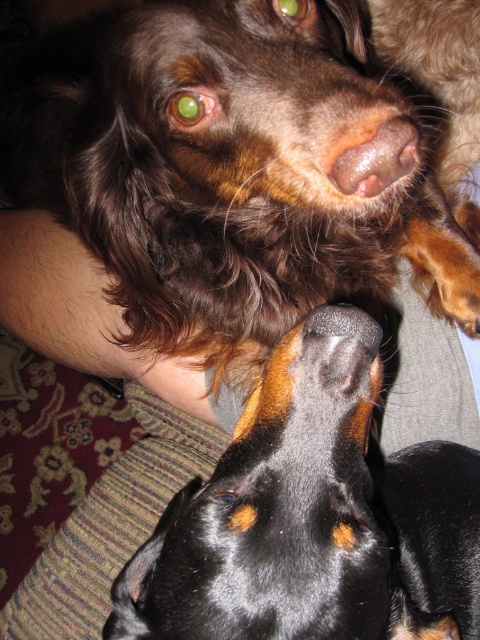
You are a photographer standing 1.5 meters away from the point at coordinates point [414,221] in the image. Can you fit both dogs into your camera frame without moving? The camera has a 50mm lens.

The distance of point [414,221] from the camera is 1.04 meters. Since you are standing 1.5 meters away from this point, you are further back than the camera position. This means the dogs are closer to the camera than your current position, so adjusting your position to be at the camera distance of 1.04 meters would allow you to capture both dogs in the frame with a 50mm lens.

You are a photographer trying to capture the perfect shot of the two dogs. You notice the brown shiny coat at upper center and the brown matte nose at center. Which object should you focus on if you want to highlight something taller in the frame?

The brown shiny coat at upper center is taller than the brown matte nose at center, so focusing on the brown shiny coat at upper center would highlight the taller object in the frame.